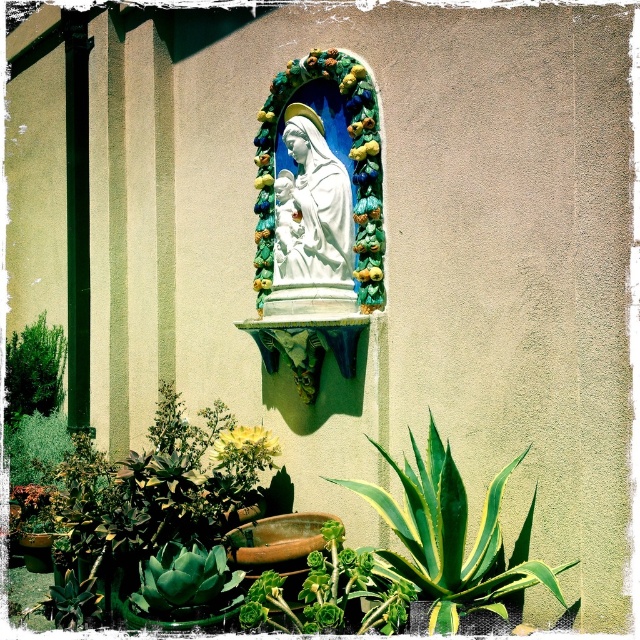
Measure the distance from green leafy plant at lower right to green succulent at center.

The distance of green leafy plant at lower right from green succulent at center is 22.51 centimeters.

Image resolution: width=640 pixels, height=640 pixels. In order to click on green leafy plant at lower right in this screenshot , I will do pos(451,538).

Describe the element at coordinates (310, 205) in the screenshot. The width and height of the screenshot is (640, 640). I see `white marble statue at center` at that location.

Can you confirm if white marble statue at center is smaller than yellow matte flower at center?

No, white marble statue at center is not smaller than yellow matte flower at center.

I want to click on white marble statue at center, so click(x=310, y=205).

Is yellow matte flower at center thinner than smooth red flower at lower left?

Yes, yellow matte flower at center is thinner than smooth red flower at lower left.

Who is positioned more to the left, yellow matte flower at center or smooth red flower at lower left?

From the viewer's perspective, smooth red flower at lower left appears more on the left side.

Between point (260, 440) and point (38, 500), which one is positioned behind?

Point (38, 500)

At what (x,y) coordinates should I click in order to perform the action: click on yellow matte flower at center. Please return your answer as a coordinate pair (x, y). This screenshot has height=640, width=640. Looking at the image, I should click on (244, 448).